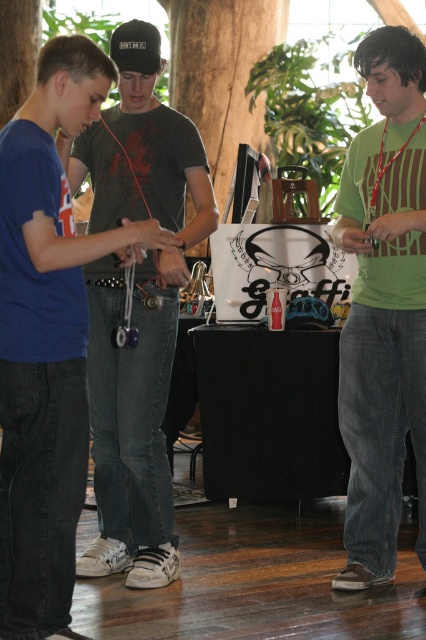
Question: Which point is farther to the camera?

Choices:
 (A) dark green t-shirt at center
 (B) green matte shirt at right

Answer: (A)

Question: Considering the real-world distances, which object is farthest from the black matte baseball cap at upper left?

Choices:
 (A) dark green t-shirt at center
 (B) green matte shirt at right

Answer: (B)

Question: Which of the following is the farthest from the observer?

Choices:
 (A) (127, 58)
 (B) (164, 502)

Answer: (B)

Question: Considering the relative positions of dark green t-shirt at center and black matte baseball cap at upper left in the image provided, where is dark green t-shirt at center located with respect to black matte baseball cap at upper left?

Choices:
 (A) above
 (B) below

Answer: (B)

Question: Does dark green t-shirt at center appear on the left side of green matte shirt at right?

Choices:
 (A) no
 (B) yes

Answer: (B)

Question: Does green matte shirt at right have a greater width compared to black matte baseball cap at upper left?

Choices:
 (A) no
 (B) yes

Answer: (B)